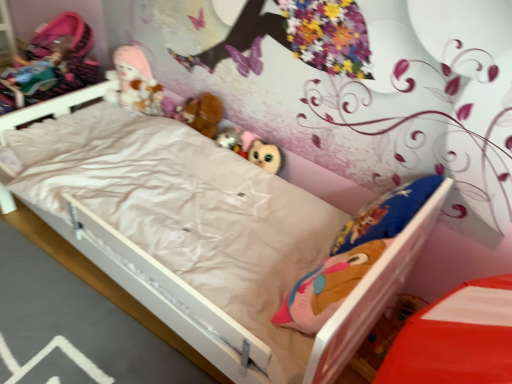
Question: From the image's perspective, is fuzzy fabric plush at center, arranged as the second toy when viewed from the top, under brown plush at center, arranged as the first doll when viewed from the right?

Choices:
 (A) no
 (B) yes

Answer: (B)

Question: Is fuzzy fabric plush at center, marked as the 2th toy in a front-to-back arrangement, directly adjacent to brown plush at center, arranged as the first doll when viewed from the right?

Choices:
 (A) yes
 (B) no

Answer: (B)

Question: Can you confirm if fuzzy fabric plush at center, marked as the 2th toy in a front-to-back arrangement, is bigger than brown plush at center, the second doll from the left?

Choices:
 (A) no
 (B) yes

Answer: (A)

Question: Is brown plush at center, arranged as the first doll when viewed from the right, located within fuzzy fabric plush at center, arranged as the second toy when viewed from the top?

Choices:
 (A) yes
 (B) no

Answer: (B)

Question: Does fuzzy fabric plush at center, arranged as the second toy when viewed from the top, lie behind brown plush at center, arranged as the first doll when viewed from the right?

Choices:
 (A) no
 (B) yes

Answer: (A)

Question: Considering their positions, is fuzzy fabric plush at center, the 2th toy when ordered from left to right, located in front of or behind matte plush owl at center, acting as the third toy starting from the top?

Choices:
 (A) front
 (B) behind

Answer: (B)

Question: Considering the positions of fuzzy fabric plush at center, the 2th toy when ordered from left to right, and matte plush owl at center, which is counted as the first toy, starting from the bottom, in the image, is fuzzy fabric plush at center, the 2th toy when ordered from left to right, bigger or smaller than matte plush owl at center, which is counted as the first toy, starting from the bottom,?

Choices:
 (A) big
 (B) small

Answer: (B)

Question: From a real-world perspective, is fuzzy fabric plush at center, the 2th toy when ordered from left to right, above or below matte plush owl at center, which is counted as the first toy, starting from the bottom?

Choices:
 (A) above
 (B) below

Answer: (A)

Question: Does point (236, 140) appear closer or farther from the camera than point (266, 160)?

Choices:
 (A) farther
 (B) closer

Answer: (A)

Question: Is fluffy plush toys at upper center, which is counted as the third toy, starting from the bottom, situated inside brown plush at center, arranged as the first doll when viewed from the right, or outside?

Choices:
 (A) outside
 (B) inside

Answer: (A)

Question: Considering the positions of fluffy plush toys at upper center, acting as the first toy starting from the back, and brown plush at center, the second doll from the left, in the image, is fluffy plush toys at upper center, acting as the first toy starting from the back, bigger or smaller than brown plush at center, the second doll from the left,?

Choices:
 (A) small
 (B) big

Answer: (A)

Question: From a real-world perspective, is fluffy plush toys at upper center, the 3th toy viewed from the front, above or below brown plush at center, the second doll from the left?

Choices:
 (A) above
 (B) below

Answer: (B)

Question: Would you say fluffy plush toys at upper center, the 3th toy viewed from the front, is to the left or to the right of brown plush at center, the second doll from the left, in the picture?

Choices:
 (A) right
 (B) left

Answer: (B)

Question: Does point (271, 165) appear closer or farther from the camera than point (135, 92)?

Choices:
 (A) farther
 (B) closer

Answer: (B)

Question: Choose the correct answer: Is matte plush owl at center, which is counted as the first toy, starting from the bottom, inside fluffy plush toys at upper center, acting as the first toy starting from the back, or outside it?

Choices:
 (A) outside
 (B) inside

Answer: (A)